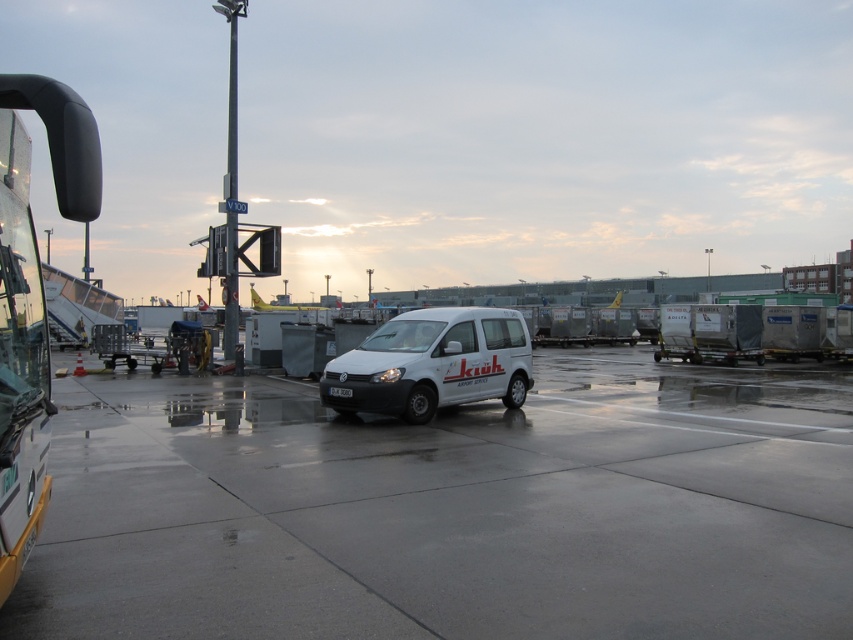
From the picture: You are a delivery person needing to park your vehicle on the airport tarmac. You see the matte black bus at left and the white matte van at center. Which vehicle should you avoid parking next to if you need more space around your vehicle?

You should avoid parking next to the matte black bus at left because it is smaller in size compared to the white matte van at center, leaving less space around your vehicle.

Based on the photo, you are a delivery driver who needs to park your truck between the matte black bus at left and the white matte van at center. Is there enough space between them to fit your truck that is 10 meters long?

The matte black bus at left is positioned on the left side of the white matte van at center. However, the exact distance between them isn not provided in the Objects Description. Therefore, it is impossible to determine if there is enough space for a 10 meter long truck.

You are a pilot trying to park your small aircraft on the airport tarmac. You see the white concrete tarmac at center and the white matte van at center. Which surface can accommodate your aircraft better in terms of size?

The white concrete tarmac at center has a larger size compared to the white matte van at center, so it can accommodate your aircraft better.